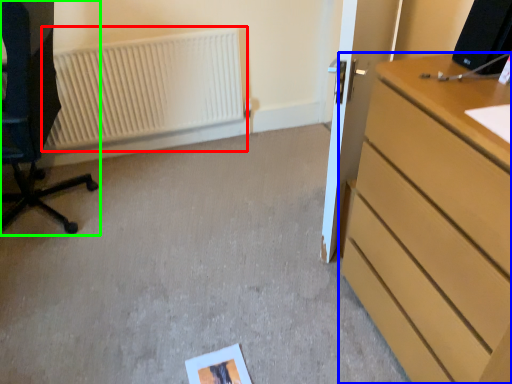
Question: Which object is the farthest from radiator (highlighted by a red box)? Choose among these: chest of drawers (highlighted by a blue box) or furniture (highlighted by a green box).

Choices:
 (A) chest of drawers
 (B) furniture

Answer: (A)